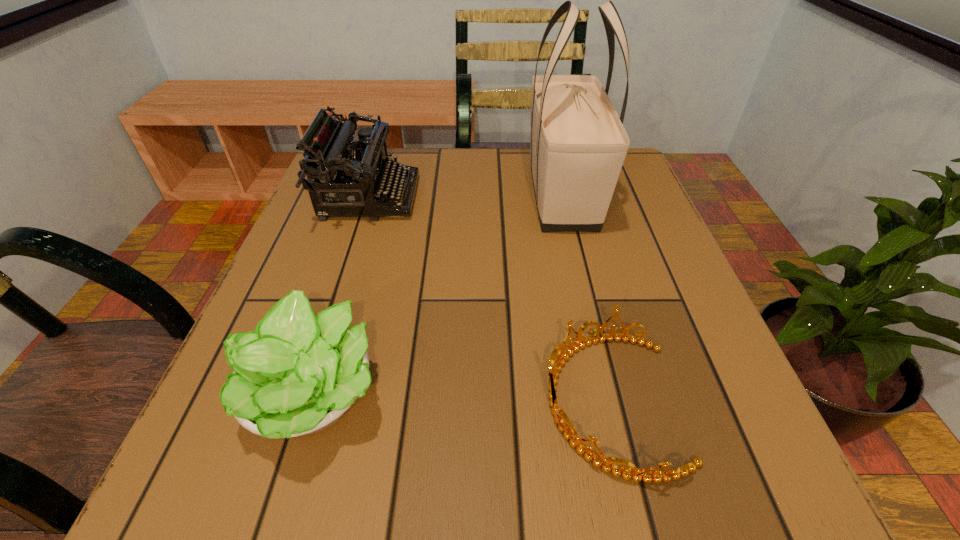
You are a GUI agent. You are given a task and a screenshot of the screen. Output one action in this format:
    pyautogui.click(x=<x>, y=<y>)
    Task: Click on the free space that satisfies the following two spatial constraints: 1. on the keyboard of the lettuce; 2. on the right side of the third shortest object
    The height and width of the screenshot is (540, 960).
    Given the screenshot: What is the action you would take?
    pyautogui.click(x=306, y=394)

The width and height of the screenshot is (960, 540). Identify the location of free spot that satisfies the following two spatial constraints: 1. with handles facing forward on the tallest object; 2. on the front-facing side of the tiara. pyautogui.click(x=612, y=401).

You are a GUI agent. You are given a task and a screenshot of the screen. Output one action in this format:
    pyautogui.click(x=<x>, y=<y>)
    Task: Click on the vacant space that satisfies the following two spatial constraints: 1. with handles facing forward on the tallest object; 2. on the keyboard of the typewriter
    Image resolution: width=960 pixels, height=540 pixels.
    Given the screenshot: What is the action you would take?
    pyautogui.click(x=563, y=197)

This screenshot has height=540, width=960. I want to click on free spot that satisfies the following two spatial constraints: 1. with handles facing forward on the shopping bag; 2. on the keyboard of the third shortest object, so click(563, 197).

At what (x,y) coordinates should I click in order to perform the action: click on vacant space that satisfies the following two spatial constraints: 1. with handles facing forward on the shopping bag; 2. on the front-facing side of the tiara. Please return your answer as a coordinate pair (x, y). The width and height of the screenshot is (960, 540). Looking at the image, I should click on (612, 401).

You are a GUI agent. You are given a task and a screenshot of the screen. Output one action in this format:
    pyautogui.click(x=<x>, y=<y>)
    Task: Click on the vacant region that satisfies the following two spatial constraints: 1. with handles facing forward on the shopping bag; 2. on the keyboard of the third shortest object
    
    Given the screenshot: What is the action you would take?
    pyautogui.click(x=563, y=197)

You are a GUI agent. You are given a task and a screenshot of the screen. Output one action in this format:
    pyautogui.click(x=<x>, y=<y>)
    Task: Click on the free point that satisfies the following two spatial constraints: 1. with handles facing forward on the tallest object; 2. on the front-facing side of the tiara
    This screenshot has width=960, height=540.
    Given the screenshot: What is the action you would take?
    pyautogui.click(x=612, y=401)

The width and height of the screenshot is (960, 540). What are the coordinates of `free spot that satisfies the following two spatial constraints: 1. with handles facing forward on the tallest object; 2. on the front-facing side of the tiara` in the screenshot? It's located at pos(612,401).